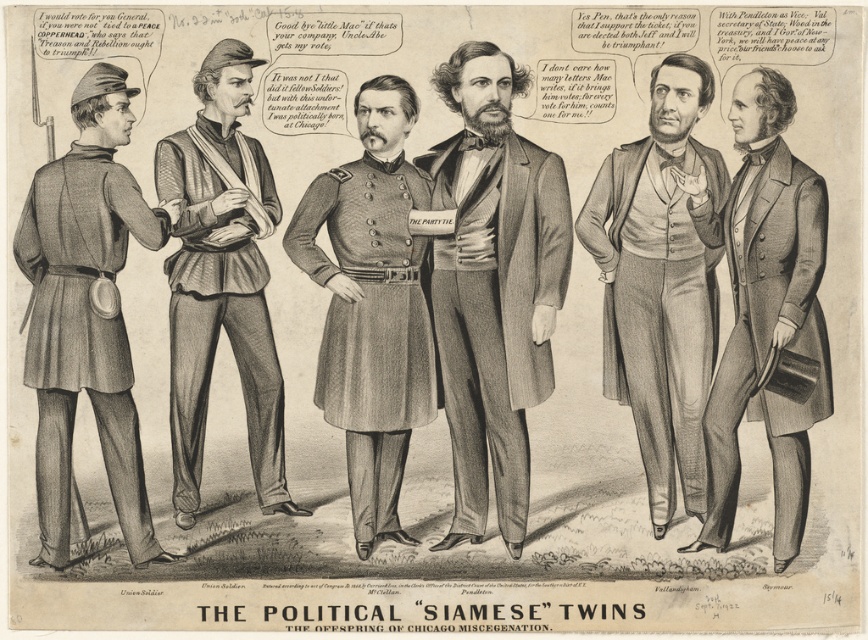
Question: Which of these objects is positioned farthest from the rustic leather vest at center?

Choices:
 (A) smooth gray suit at center
 (B) uniform fabric uniform at left
 (C) smooth gray coat at center
 (D) gray wool military coat at center

Answer: (C)

Question: From the image, what is the correct spatial relationship of smooth gray suit at center in relation to rustic leather vest at center?

Choices:
 (A) below
 (B) above

Answer: (A)

Question: Which object is the farthest from the uniform fabric uniform at left?

Choices:
 (A) smooth gray vest at center
 (B) rustic leather vest at center

Answer: (A)

Question: Based on their relative distances, which object is nearer to the rustic leather vest at center?

Choices:
 (A) smooth gray vest at center
 (B) gray wool military coat at center

Answer: (B)

Question: Is smooth gray coat at center positioned in front of rustic leather vest at center?

Choices:
 (A) yes
 (B) no

Answer: (A)

Question: Is smooth gray suit at center below smooth gray coat at center?

Choices:
 (A) yes
 (B) no

Answer: (B)